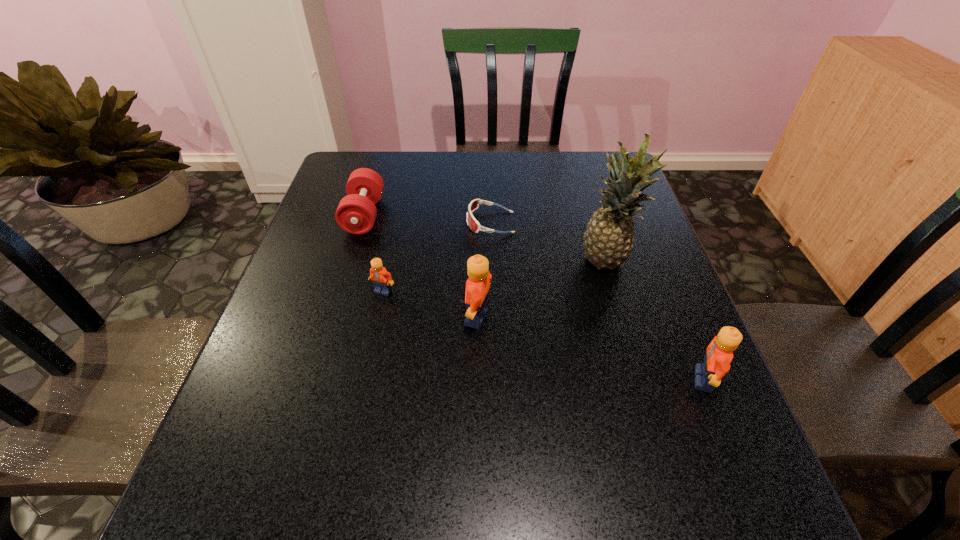
To achieve uniform spacing by inserting another Lego among them, please point to a free space for this new Lego. Please provide its 2D coordinates. Your answer should be formatted as a tuple, i.e. [(x, y)], where the tuple contains the x and y coordinates of a point satisfying the conditions above.

[(584, 347)]